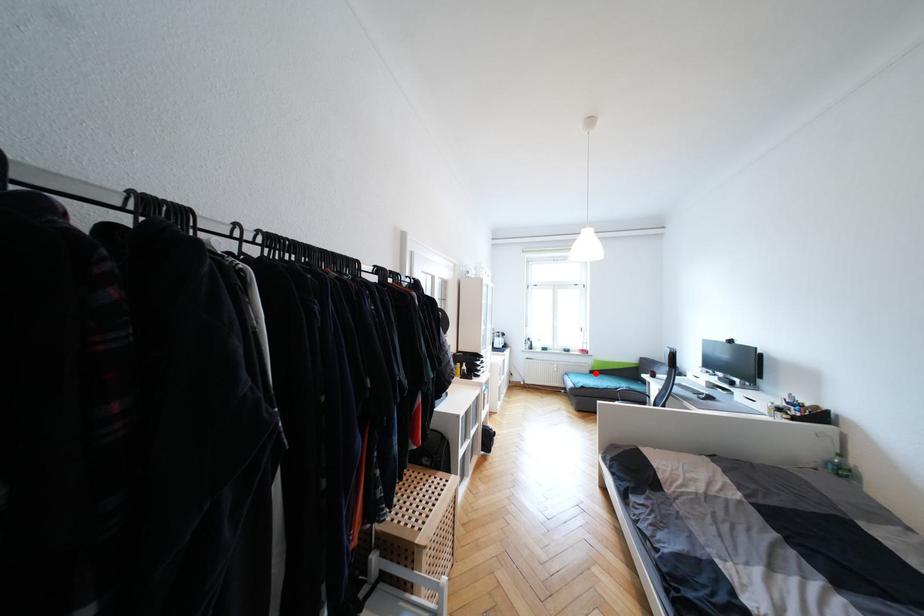
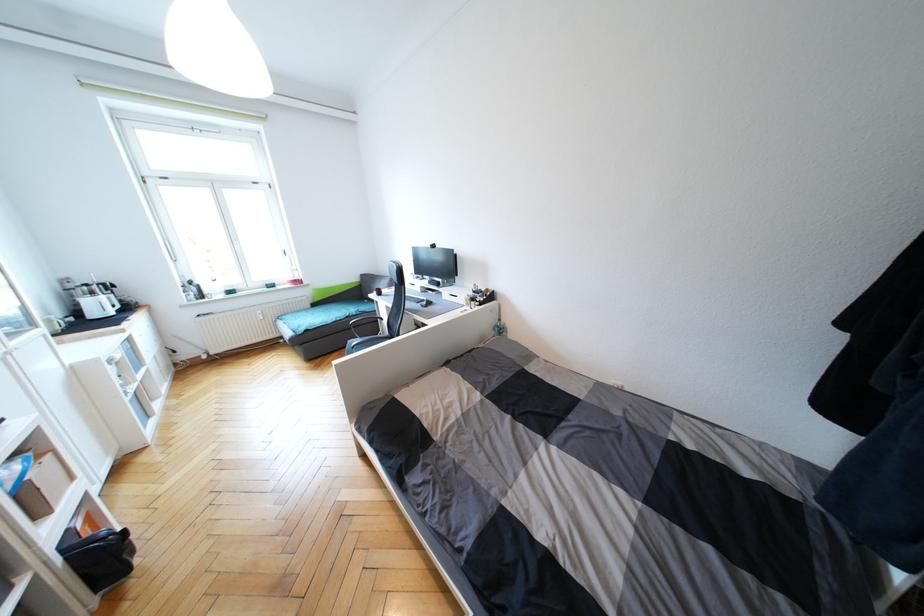
Question: I am providing you with two images of the same scene from different viewpoints. A red point is shown in image1. For the corresponding object point in image2, is it positioned nearer or farther from the camera?

Choices:
 (A) Nearer
 (B) Farther

Answer: (A)